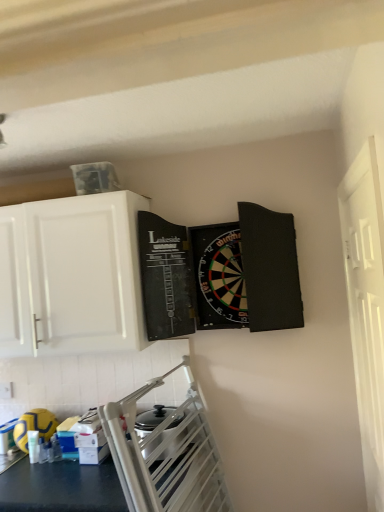
Question: From a real-world perspective, is white wooden door at right located beneath yellow rubber ball at lower left?

Choices:
 (A) yes
 (B) no

Answer: (B)

Question: Could yellow rubber ball at lower left be considered to be inside white wooden door at right?

Choices:
 (A) yes
 (B) no

Answer: (B)

Question: Considering the relative sizes of white wooden door at right and yellow rubber ball at lower left in the image provided, is white wooden door at right wider than yellow rubber ball at lower left?

Choices:
 (A) no
 (B) yes

Answer: (A)

Question: From the image's perspective, is white wooden door at right on top of yellow rubber ball at lower left?

Choices:
 (A) no
 (B) yes

Answer: (B)

Question: Is white wooden door at right not inside yellow rubber ball at lower left?

Choices:
 (A) no
 (B) yes

Answer: (B)

Question: Do you think white glossy cabinet at upper left is within white wooden door at right, or outside of it?

Choices:
 (A) inside
 (B) outside

Answer: (B)

Question: From a real-world perspective, is white glossy cabinet at upper left positioned above or below white wooden door at right?

Choices:
 (A) below
 (B) above

Answer: (B)

Question: Considering their positions, is white glossy cabinet at upper left located in front of or behind white wooden door at right?

Choices:
 (A) behind
 (B) front

Answer: (A)

Question: Does point (16, 269) appear closer or farther from the camera than point (370, 441)?

Choices:
 (A) closer
 (B) farther

Answer: (B)

Question: Is yellow rubber ball at lower left in front of or behind white wooden door at right in the image?

Choices:
 (A) behind
 (B) front

Answer: (A)

Question: Is point (52, 426) positioned closer to the camera than point (375, 507)?

Choices:
 (A) closer
 (B) farther

Answer: (B)

Question: From a real-world perspective, relative to white wooden door at right, is yellow rubber ball at lower left vertically above or below?

Choices:
 (A) above
 (B) below

Answer: (B)

Question: Choose the correct answer: Is yellow rubber ball at lower left inside white wooden door at right or outside it?

Choices:
 (A) inside
 (B) outside

Answer: (B)

Question: From their relative heights in the image, would you say white glossy cabinet at upper left is taller or shorter than yellow rubber ball at lower left?

Choices:
 (A) short
 (B) tall

Answer: (B)

Question: Does point (67, 273) appear closer or farther from the camera than point (23, 438)?

Choices:
 (A) farther
 (B) closer

Answer: (B)